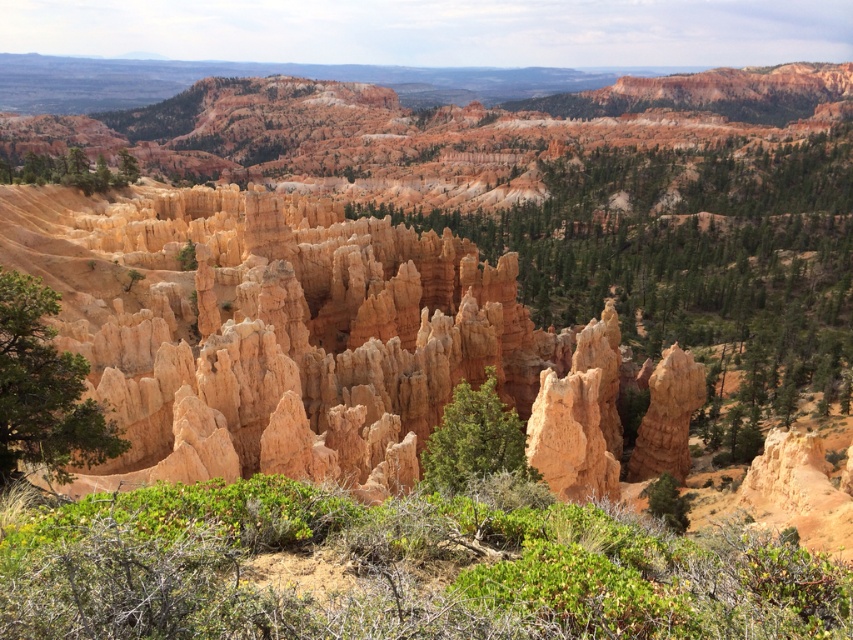
Question: Estimate the real-world distances between objects in this image. Which object is farther from the green textured tree at center?

Choices:
 (A) green leafy tree at left
 (B) green leafy tree at upper left

Answer: (B)

Question: Which point is closer to the camera?

Choices:
 (A) (114, 436)
 (B) (9, 173)

Answer: (A)

Question: Does green leafy tree at left have a greater width compared to green leafy tree at upper left?

Choices:
 (A) no
 (B) yes

Answer: (A)

Question: Can you confirm if green textured tree at center is smaller than green leafy tree at upper left?

Choices:
 (A) yes
 (B) no

Answer: (A)

Question: Is green leafy tree at left smaller than green textured tree at center?

Choices:
 (A) no
 (B) yes

Answer: (B)

Question: Which object appears farthest from the camera in this image?

Choices:
 (A) green leafy tree at upper left
 (B) green textured tree at center

Answer: (A)